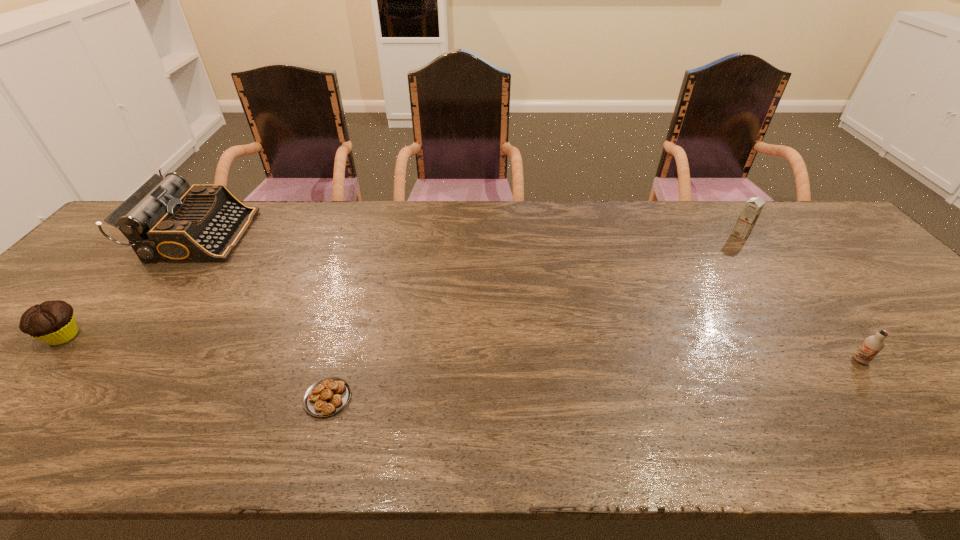
You are a GUI agent. You are given a task and a screenshot of the screen. Output one action in this format:
    pyautogui.click(x=<x>, y=<y>)
    Task: Click on the free location located on the back of the shorter chocolate milk
    
    Given the screenshot: What is the action you would take?
    pyautogui.click(x=832, y=325)

Locate an element on the screen. free space located on the front of the muffin is located at coordinates click(x=29, y=374).

In order to click on vacant area situated 0.360m on the left of the third object from right to left in this screenshot , I will do `click(134, 398)`.

Locate an element on the screen. The height and width of the screenshot is (540, 960). typewriter located in the far edge section of the desktop is located at coordinates (165, 220).

This screenshot has width=960, height=540. In order to click on chocolate milk situated at the far edge in this screenshot , I will do `click(753, 207)`.

Image resolution: width=960 pixels, height=540 pixels. I want to click on object that is at the near edge, so click(327, 396).

This screenshot has height=540, width=960. I want to click on typewriter at the left edge, so click(165, 220).

Where is `muffin situated at the left edge`? Image resolution: width=960 pixels, height=540 pixels. muffin situated at the left edge is located at coordinates (53, 322).

You are a GUI agent. You are given a task and a screenshot of the screen. Output one action in this format:
    pyautogui.click(x=<x>, y=<y>)
    Task: Click on the object situated at the far left corner
    The height and width of the screenshot is (540, 960).
    Given the screenshot: What is the action you would take?
    pyautogui.click(x=165, y=220)

This screenshot has height=540, width=960. What are the coordinates of `vacant space at the far edge` in the screenshot? It's located at (425, 243).